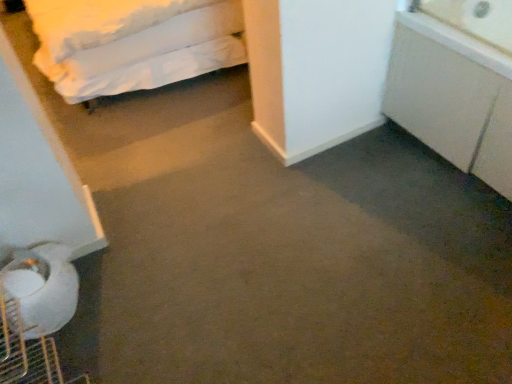
In order to click on white matte cabinet at right in this screenshot , I will do `click(452, 97)`.

The image size is (512, 384). Describe the element at coordinates (452, 97) in the screenshot. I see `white matte cabinet at right` at that location.

This screenshot has height=384, width=512. I want to click on white soft bed at upper left, so click(252, 58).

This screenshot has height=384, width=512. What do you see at coordinates (252, 58) in the screenshot?
I see `white soft bed at upper left` at bounding box center [252, 58].

What is the approximate width of white soft bed at upper left?

1.61 meters.

The width and height of the screenshot is (512, 384). I want to click on white matte cabinet at right, so click(452, 97).

From the picture: Considering the positions of objects white matte cabinet at right and white soft bed at upper left in the image provided, who is more to the right, white matte cabinet at right or white soft bed at upper left?

Positioned to the right is white matte cabinet at right.

From the picture: Is white matte cabinet at right in front of or behind white soft bed at upper left in the image?

In the image, white matte cabinet at right appears in front of white soft bed at upper left.

Is point (405, 46) in front of point (326, 69)?

No, it is not.

From the image's perspective, is white matte cabinet at right above white soft bed at upper left?

Incorrect, from the image's perspective, white matte cabinet at right is lower than white soft bed at upper left.

From a real-world perspective, who is located higher, white matte cabinet at right or white soft bed at upper left?

From a 3D spatial view, white soft bed at upper left is above.

Which of these two, white matte cabinet at right or white soft bed at upper left, is thinner?

white matte cabinet at right.

Considering the sizes of objects white matte cabinet at right and white soft bed at upper left in the image provided, who is shorter, white matte cabinet at right or white soft bed at upper left?

white matte cabinet at right.

Who is bigger, white matte cabinet at right or white soft bed at upper left?

white soft bed at upper left.

Is white matte cabinet at right not inside white soft bed at upper left?

Indeed, white matte cabinet at right is completely outside white soft bed at upper left.

Is white matte cabinet at right touching white soft bed at upper left?

They are not placed beside each other.

Is white matte cabinet at right aimed at white soft bed at upper left?

No, white matte cabinet at right does not turn towards white soft bed at upper left.

What's the angular difference between white matte cabinet at right and white soft bed at upper left's facing directions?

The angle between the facing direction of white matte cabinet at right and the facing direction of white soft bed at upper left is 0.883 degrees.

Locate an element on the screen. Image resolution: width=512 pixels, height=384 pixels. cabinetry in front of the white soft bed at upper left is located at coordinates (452, 97).

Is white soft bed at upper left to the right of white matte cabinet at right from the viewer's perspective?

No, white soft bed at upper left is not to the right of white matte cabinet at right.

Which is in front, white soft bed at upper left or white matte cabinet at right?

Positioned in front is white matte cabinet at right.

Does point (270, 7) come farther from viewer compared to point (497, 139)?

Yes, it is.

From the image's perspective, between white soft bed at upper left and white matte cabinet at right, who is located below?

white matte cabinet at right appears lower in the image.

From a real-world perspective, is white soft bed at upper left on white matte cabinet at right?

Indeed, from a real-world perspective, white soft bed at upper left stands above white matte cabinet at right.

Considering the sizes of objects white soft bed at upper left and white matte cabinet at right in the image provided, who is wider, white soft bed at upper left or white matte cabinet at right?

white soft bed at upper left is wider.

Between white soft bed at upper left and white matte cabinet at right, which one has less height?

With less height is white matte cabinet at right.

Considering the sizes of white soft bed at upper left and white matte cabinet at right in the image, is white soft bed at upper left bigger or smaller than white matte cabinet at right?

Clearly, white soft bed at upper left is larger in size than white matte cabinet at right.

In the scene shown: Does white soft bed at upper left contain white matte cabinet at right?

Definitely not — white matte cabinet at right is not inside white soft bed at upper left.

Consider the image. Is white soft bed at upper left not near white matte cabinet at right?

Actually, white soft bed at upper left and white matte cabinet at right are a little close together.

Is white soft bed at upper left turned away from white matte cabinet at right?

No, white matte cabinet at right is not at the back of white soft bed at upper left.

How many degrees apart are the facing directions of white soft bed at upper left and white matte cabinet at right?

The angle between the facing direction of white soft bed at upper left and the facing direction of white matte cabinet at right is 0.883 degrees.

At what (x,y) coordinates should I click in order to perform the action: click on cabinetry in front of the white soft bed at upper left. Please return your answer as a coordinate pair (x, y). The height and width of the screenshot is (384, 512). Looking at the image, I should click on (452, 97).

You are a GUI agent. You are given a task and a screenshot of the screen. Output one action in this format:
    pyautogui.click(x=<x>, y=<y>)
    Task: Click on the bed above the white matte cabinet at right (from the image's perspective)
    The height and width of the screenshot is (384, 512).
    Given the screenshot: What is the action you would take?
    pyautogui.click(x=252, y=58)

Where is `cabinetry beneath the white soft bed at upper left (from a real-world perspective)`? The width and height of the screenshot is (512, 384). cabinetry beneath the white soft bed at upper left (from a real-world perspective) is located at coordinates (452, 97).